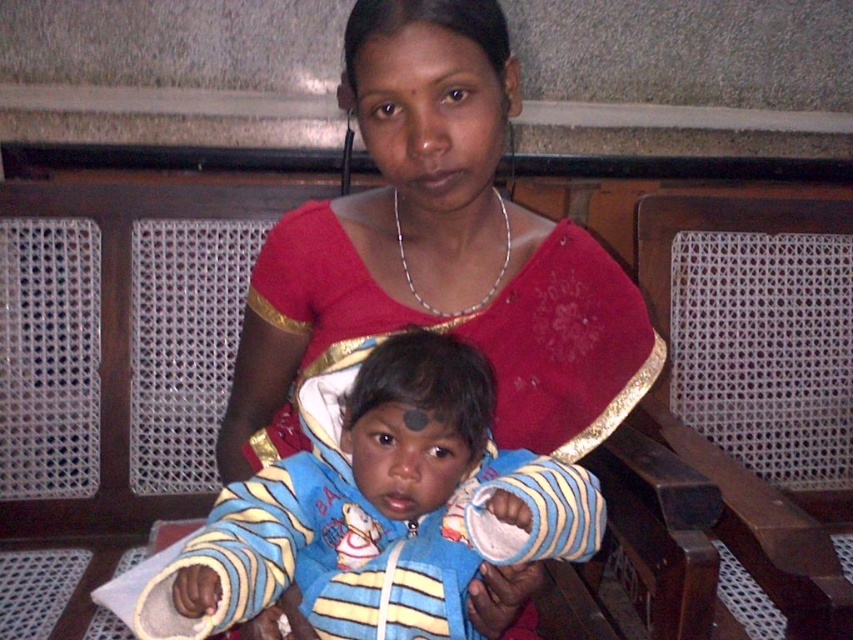
You are a tailor measuring the distance between the matte red blouse at center and the blue striped fabric at center for a custom fit. Can you fit a 5 inch wide decorative ribbon between them?

The distance between the matte red blouse at center and the blue striped fabric at center is 4.75 inches, which is less than the 5 inch width of the ribbon. Therefore, the ribbon cannot fit between them.

You are standing in front of the bench where the two people are sitting. There are two points marked on the bench. One is at coordinate point (456,54) and the other is at point (383,433). Which point is closer to you?

Point (456,54) is closer to the viewer than point (383,433).